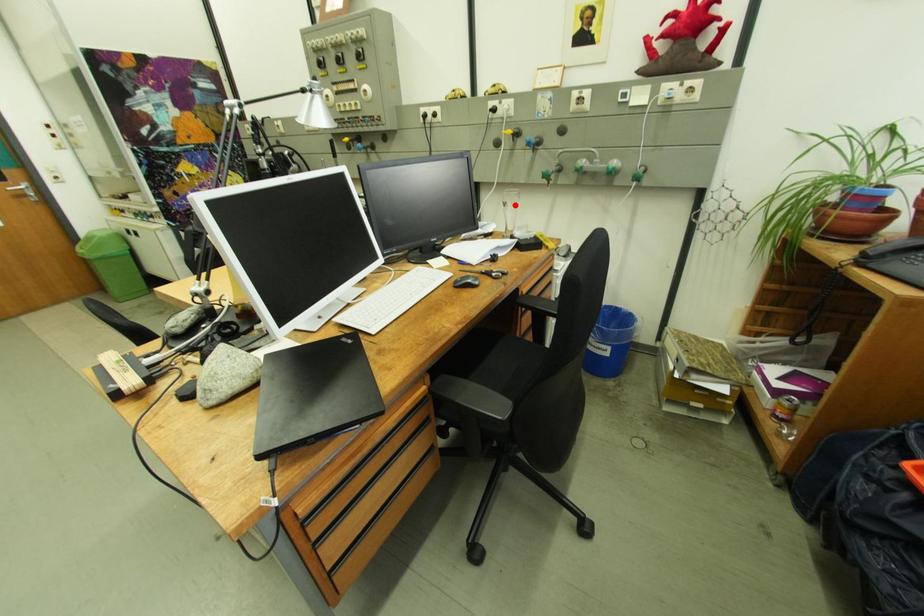
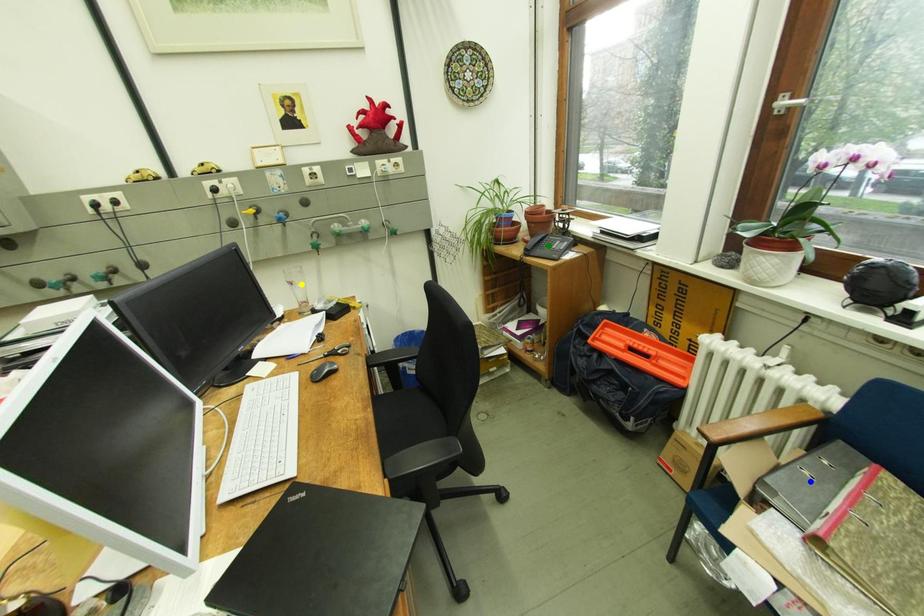
Question: I am providing you with two images of the same scene from different viewpoints. A red point is marked on the first image. You are given multiple points on the second image. Which point in image 2 represents the same 3d spot as the red point in image 1?

Choices:
 (A) blue point
 (B) yellow point
 (C) green point

Answer: (B)